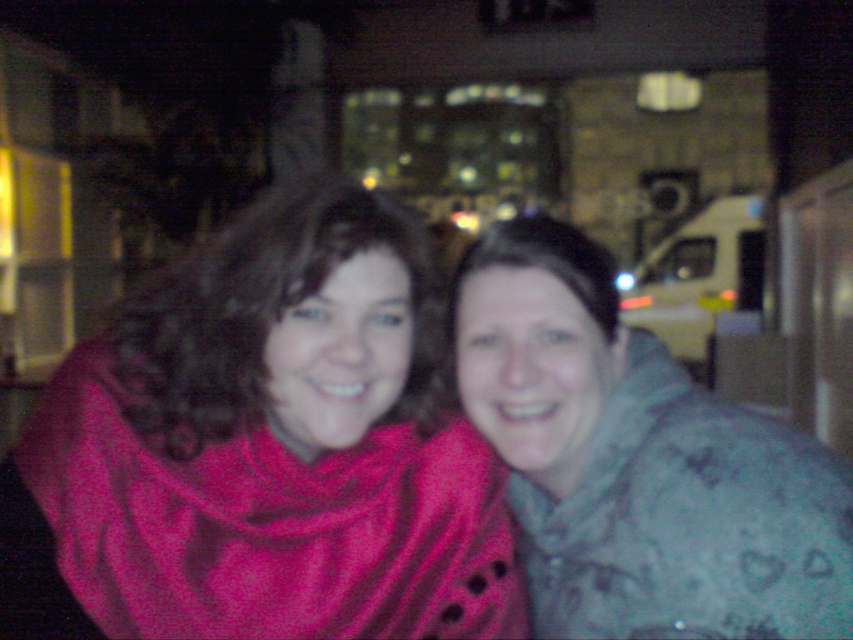
You are a photographer adjusting lighting for a night portrait. You notice the matte red scarf at left and the gray fuzzy jacket at center. Which object should you focus on first if you want to highlight the taller one?

The matte red scarf at left is taller than the gray fuzzy jacket at center, so you should focus on the matte red scarf at left first.

You are a photographer trying to capture a closeup of the matte red scarf at left and the gray fuzzy jacket at center. Since the camera can only focus on one object at a time, which object should you choose to ensure it appears sharp and in focus?

The matte red scarf at left is larger in size than the gray fuzzy jacket at center, so you should focus on the matte red scarf at left to ensure it appears sharp and in focus.